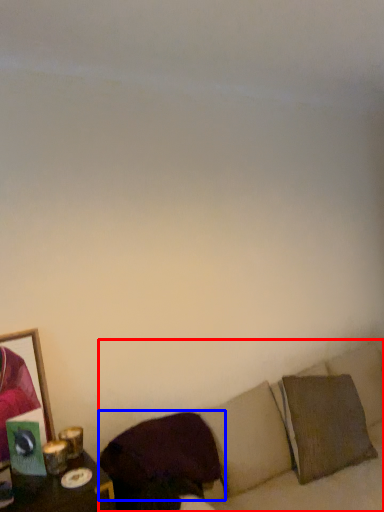
Question: Among these objects, which one is nearest to the camera, couch (highlighted by a red box) or pillow (highlighted by a blue box)?

Choices:
 (A) couch
 (B) pillow

Answer: (A)